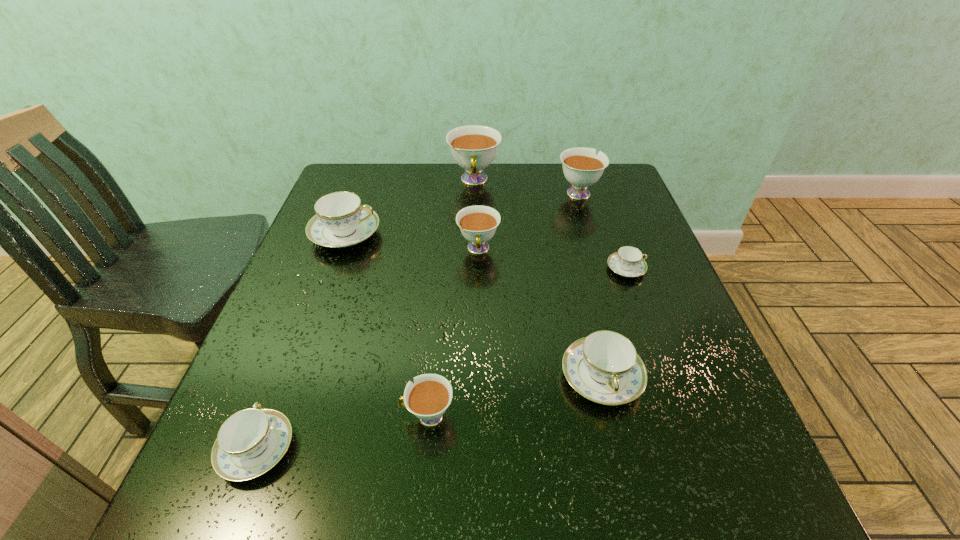
In order to click on vacant space that satisfies the following two spatial constraints: 1. on the side of the biggest white teacup with the handle; 2. on the side with the handle of the biggest blue teacup in this screenshot , I will do `click(473, 234)`.

Find the location of a particular element. The width and height of the screenshot is (960, 540). vacant space that satisfies the following two spatial constraints: 1. on the side with the handle of the second nearest blue teacup; 2. on the side of the smallest white teacup with the handle is located at coordinates (611, 416).